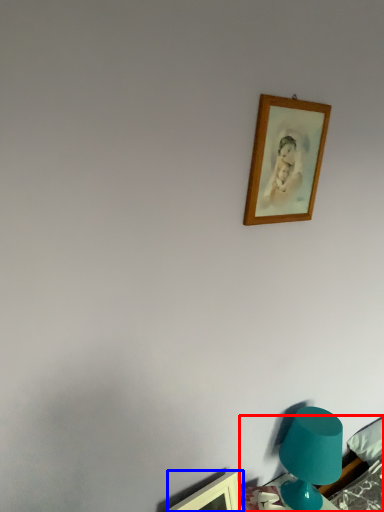
Question: Which object appears farthest to the camera in this image, furniture (highlighted by a red box) or picture frame (highlighted by a blue box)?

Choices:
 (A) furniture
 (B) picture frame

Answer: (A)